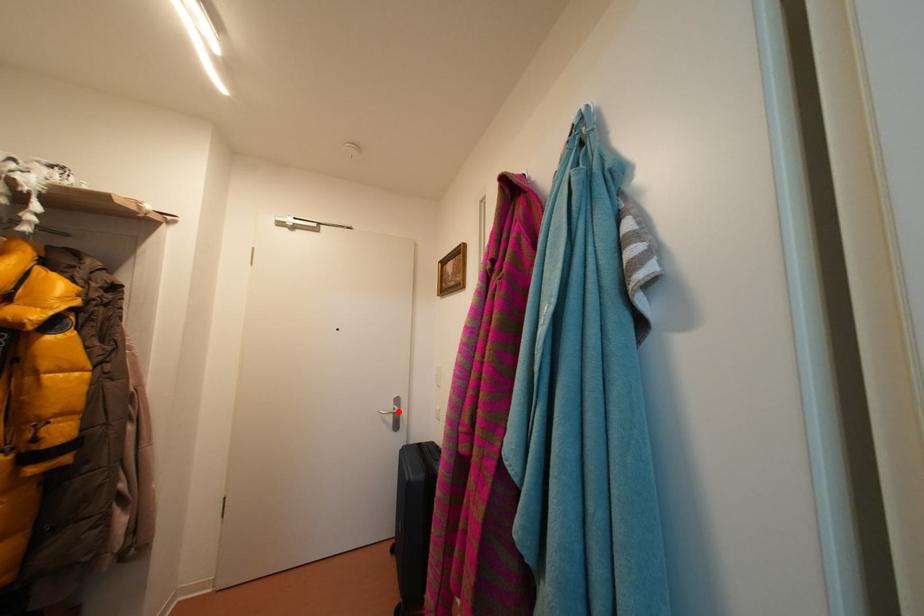
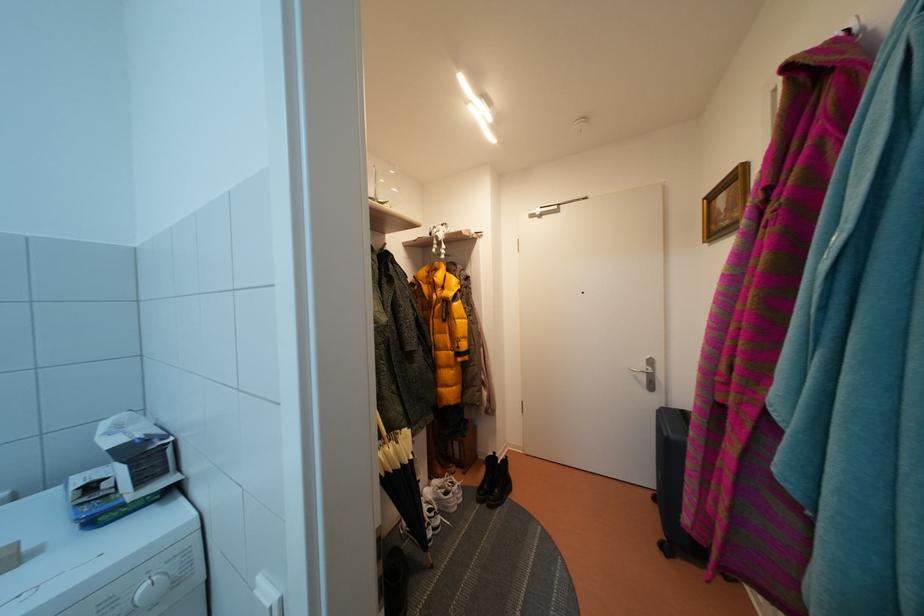
In the second image, find the point that corresponds to the highlighted location in the first image.

(650, 371)